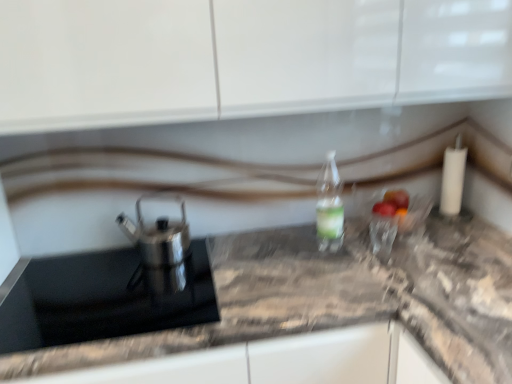
At what (x,y) coordinates should I click in order to perform the action: click on black glass sink at left. Please return your answer as a coordinate pair (x, y). Looking at the image, I should click on (112, 288).

The image size is (512, 384). Identify the location of clear plastic bottle at center. (329, 206).

Is marble gray countertop at center at the left side of clear plastic bottle at center?

Yes.

Can you confirm if marble gray countertop at center is bigger than clear plastic bottle at center?

Yes, marble gray countertop at center is bigger than clear plastic bottle at center.

Are marble gray countertop at center and clear plastic bottle at center beside each other?

They are not placed beside each other.

Is marble gray countertop at center oriented towards clear plastic bottle at center?

No, marble gray countertop at center is not oriented towards clear plastic bottle at center.

Does marble gray countertop at center have a smaller size compared to satin silver teapot at left?

No, marble gray countertop at center is not smaller than satin silver teapot at left.

Who is taller, marble gray countertop at center or satin silver teapot at left?

Standing taller between the two is marble gray countertop at center.

From the image's perspective, is marble gray countertop at center located above or below satin silver teapot at left?

From the image's perspective, marble gray countertop at center appears below satin silver teapot at left.

Is the surface of satin silver teapot at left in direct contact with clear plastic bottle at center?

satin silver teapot at left is not next to clear plastic bottle at center, and they're not touching.

Considering the relative sizes of satin silver teapot at left and clear plastic bottle at center in the image provided, is satin silver teapot at left taller than clear plastic bottle at center?

No.

Is satin silver teapot at left surrounding clear plastic bottle at center?

That's incorrect, clear plastic bottle at center is not inside satin silver teapot at left.

From a real-world perspective, is satin silver teapot at left beneath clear plastic bottle at center?

Correct, in the physical world, satin silver teapot at left is lower than clear plastic bottle at center.

Locate an element on the screen. Image resolution: width=512 pixels, height=384 pixels. bottle above the satin silver teapot at left (from a real-world perspective) is located at coordinates (329, 206).

Based on their sizes in the image, would you say clear plastic bottle at center is bigger or smaller than satin silver teapot at left?

In the image, clear plastic bottle at center appears to be smaller than satin silver teapot at left.

Is clear plastic bottle at center positioned with its back to satin silver teapot at left?

clear plastic bottle at center does not have its back to satin silver teapot at left.

Which object is positioned more to the left, satin silver teapot at left or marble gray countertop at center?

Positioned to the left is satin silver teapot at left.

Considering the relative sizes of satin silver teapot at left and marble gray countertop at center in the image provided, is satin silver teapot at left shorter than marble gray countertop at center?

Yes, satin silver teapot at left is shorter than marble gray countertop at center.

Identify the location of countertop below the satin silver teapot at left (from the image's perspective). The height and width of the screenshot is (384, 512). (339, 298).

Is satin silver teapot at left wider than marble gray countertop at center?

No.

Relative to black glass sink at left, is marble gray countertop at center in front or behind?

marble gray countertop at center is in front of black glass sink at left.

Is black glass sink at left at the back of marble gray countertop at center?

No, marble gray countertop at center is not facing away from black glass sink at left.

Does marble gray countertop at center appear on the left side of black glass sink at left?

Incorrect, marble gray countertop at center is not on the left side of black glass sink at left.

Considering the relative sizes of marble gray countertop at center and black glass sink at left in the image provided, is marble gray countertop at center smaller than black glass sink at left?

Incorrect, marble gray countertop at center is not smaller in size than black glass sink at left.

Is black glass sink at left with marble gray countertop at center?

No, black glass sink at left is not making contact with marble gray countertop at center.

Looking at their sizes, would you say black glass sink at left is wider or thinner than marble gray countertop at center?

In the image, black glass sink at left appears to be more narrow than marble gray countertop at center.

Is marble gray countertop at center at the back of black glass sink at left?

Yes, black glass sink at left is facing away from marble gray countertop at center.

The height and width of the screenshot is (384, 512). I want to click on bottle on the right of marble gray countertop at center, so click(x=329, y=206).

There is a marble gray countertop at center. Where is `tea pot above it (from a real-world perspective)`? The width and height of the screenshot is (512, 384). tea pot above it (from a real-world perspective) is located at coordinates (158, 233).

Considering their positions, is black glass sink at left positioned further to clear plastic bottle at center than marble gray countertop at center?

Based on the image, black glass sink at left appears to be further to clear plastic bottle at center.

When comparing their distances from marble gray countertop at center, does black glass sink at left or clear plastic bottle at center seem further?

clear plastic bottle at center.

From the image, which object appears to be farther from marble gray countertop at center, clear plastic bottle at center or satin silver teapot at left?

satin silver teapot at left lies further to marble gray countertop at center than the other object.

Estimate the real-world distances between objects in this image. Which object is further from marble gray countertop at center, clear plastic bottle at center or black glass sink at left?

Based on the image, clear plastic bottle at center appears to be further to marble gray countertop at center.

Based on the photo, estimate the real-world distances between objects in this image. Which object is further from clear plastic bottle at center, marble gray countertop at center or satin silver teapot at left?

Based on the image, satin silver teapot at left appears to be further to clear plastic bottle at center.

Estimate the real-world distances between objects in this image. Which object is further from satin silver teapot at left, black glass sink at left or clear plastic bottle at center?

clear plastic bottle at center lies further to satin silver teapot at left than the other object.

Based on their spatial positions, is clear plastic bottle at center or black glass sink at left further from satin silver teapot at left?

Among the two, clear plastic bottle at center is located further to satin silver teapot at left.

Considering their positions, is satin silver teapot at left positioned closer to clear plastic bottle at center than black glass sink at left?

satin silver teapot at left is positioned closer to the anchor clear plastic bottle at center.

You are a GUI agent. You are given a task and a screenshot of the screen. Output one action in this format:
    pyautogui.click(x=<x>, y=<y>)
    Task: Click on the tea pot between black glass sink at left and clear plastic bottle at center
    
    Given the screenshot: What is the action you would take?
    pyautogui.click(x=158, y=233)

Find the location of `tea pot situated between black glass sink at left and marble gray countertop at center from left to right`. tea pot situated between black glass sink at left and marble gray countertop at center from left to right is located at coordinates (158, 233).

Where is `tea pot between clear plastic bottle at center and marble gray countertop at center from top to bottom`? This screenshot has width=512, height=384. tea pot between clear plastic bottle at center and marble gray countertop at center from top to bottom is located at coordinates (158, 233).

In order to click on countertop between black glass sink at left and clear plastic bottle at center in this screenshot , I will do `click(339, 298)`.